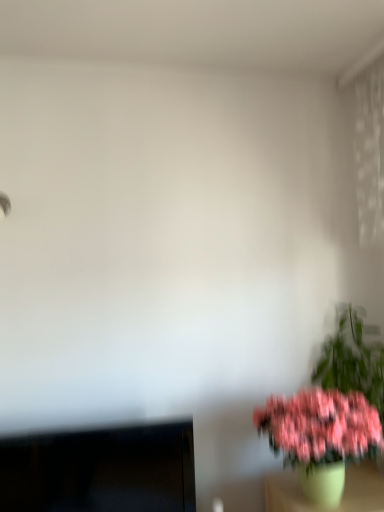
Question: Is pink matte flower pot at lower right situated inside black glossy monitor at lower left or outside?

Choices:
 (A) inside
 (B) outside

Answer: (B)

Question: From a real-world perspective, is pink matte flower pot at lower right positioned above or below black glossy monitor at lower left?

Choices:
 (A) above
 (B) below

Answer: (A)

Question: Does point coord(375,349) appear closer or farther from the camera than point coord(157,460)?

Choices:
 (A) closer
 (B) farther

Answer: (B)

Question: Based on their sizes in the image, would you say black glossy monitor at lower left is bigger or smaller than pink matte flower pot at lower right?

Choices:
 (A) small
 (B) big

Answer: (B)

Question: In terms of width, does black glossy monitor at lower left look wider or thinner when compared to pink matte flower pot at lower right?

Choices:
 (A) thin
 (B) wide

Answer: (A)

Question: Relative to pink matte flower pot at lower right, is black glossy monitor at lower left in front or behind?

Choices:
 (A) behind
 (B) front

Answer: (A)

Question: From a real-world perspective, is black glossy monitor at lower left positioned above or below pink matte flower pot at lower right?

Choices:
 (A) above
 (B) below

Answer: (B)